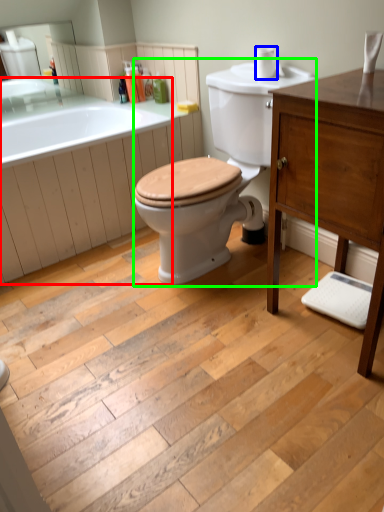
Question: Based on their relative distances, which object is nearer to bath (highlighted by a red box)? Choose from toilet paper (highlighted by a blue box) and porcelain (highlighted by a green box).

Choices:
 (A) toilet paper
 (B) porcelain

Answer: (B)